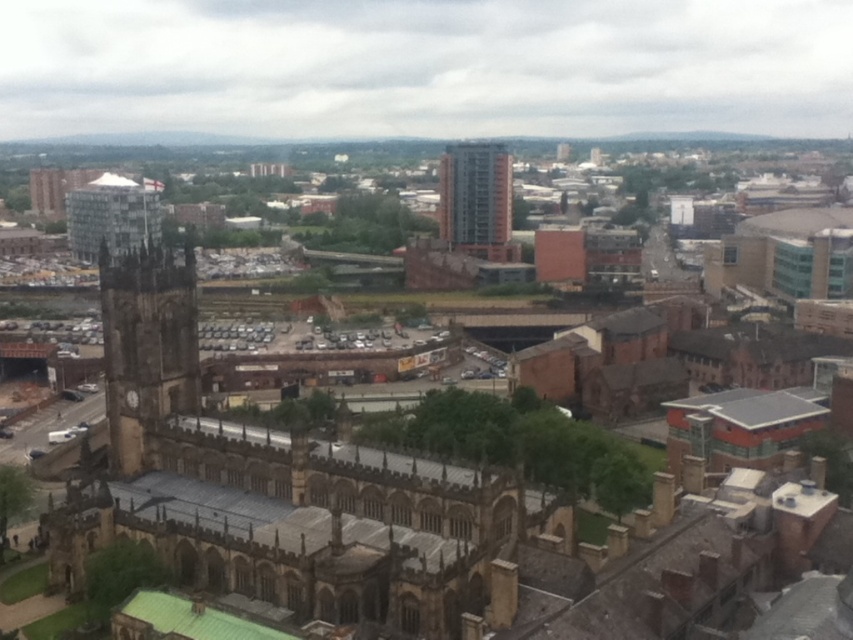
Looking at this image, you are a city planner assessing the space between the orange brick building at center and the matte glass tower at upper left. Which building occupies more horizontal space in the image?

The matte glass tower at upper left has a greater width than the orange brick building at center, so it occupies more horizontal space in the image.

You are an architect evaluating the cityscape. You need to determine which structure has a lower height. Which one is shorter between the orange brick building at center and the matte glass tower at upper left?

The orange brick building at center is shorter than the matte glass tower at upper left according to the description.

You are standing at point (146, 346) in the cityscape. What object is located exactly at your current position?

The brown stone clock tower at left is located exactly at point (146, 346).